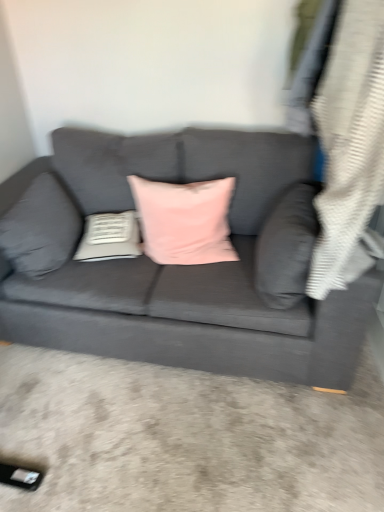
The image size is (384, 512). Find the location of `free point above white textured pillow at center, the 2th pillow viewed from the left (from a real-world perspective)`. free point above white textured pillow at center, the 2th pillow viewed from the left (from a real-world perspective) is located at coordinates (119, 216).